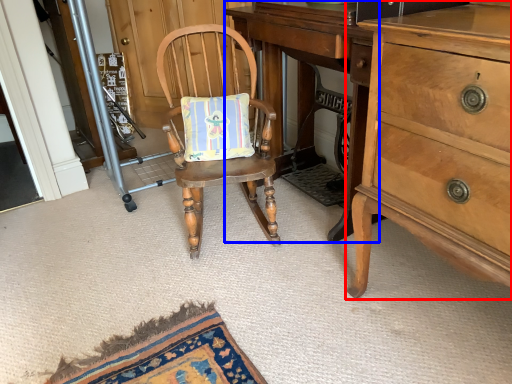
Question: Among these objects, which one is nearest to the camera, cabinetry (highlighted by a red box) or changing table (highlighted by a blue box)?

Choices:
 (A) cabinetry
 (B) changing table

Answer: (A)